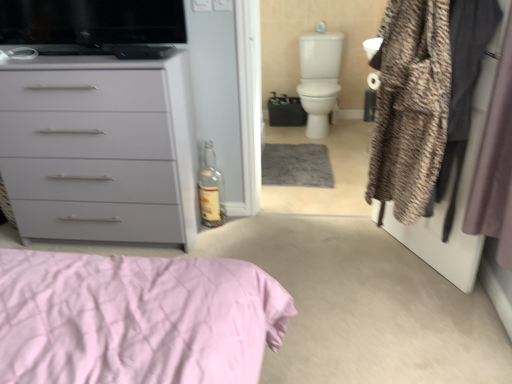
Question: Is point (464, 112) closer or farther from the camera than point (318, 102)?

Choices:
 (A) closer
 (B) farther

Answer: (A)

Question: Considering the positions of textured brown coat at right and white glossy toilet bowl at upper right in the image, is textured brown coat at right taller or shorter than white glossy toilet bowl at upper right?

Choices:
 (A) tall
 (B) short

Answer: (A)

Question: Considering the real-world distances, which object is closest to the silky purple curtain at right?

Choices:
 (A) black glossy tv at upper left
 (B) matte gray chest of drawers at left
 (C) fuzzy fabric coat at right
 (D) transparent glass bottle at center
 (E) textured brown coat at right

Answer: (E)

Question: Estimate the real-world distances between objects in this image. Which object is closer to the textured brown coat at right?

Choices:
 (A) white glossy toilet bowl at upper right
 (B) black glossy tv at upper left
 (C) fuzzy fabric coat at right
 (D) silky purple curtain at right
 (E) transparent glass bottle at center

Answer: (C)